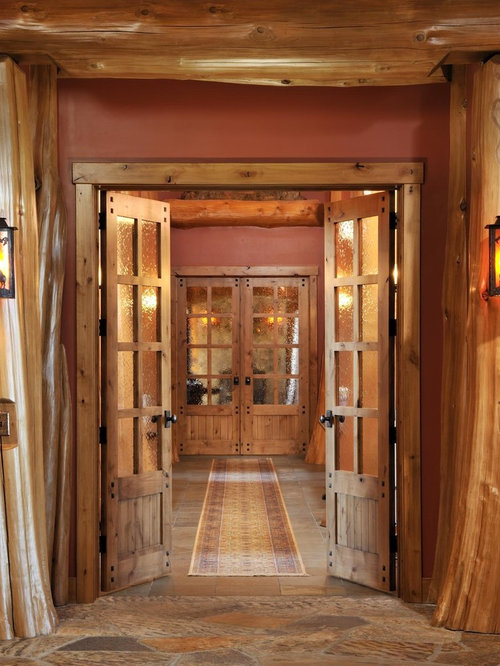
Identify the location of door knobs. (171, 419), (321, 417), (341, 418), (156, 418), (236, 379), (247, 379).